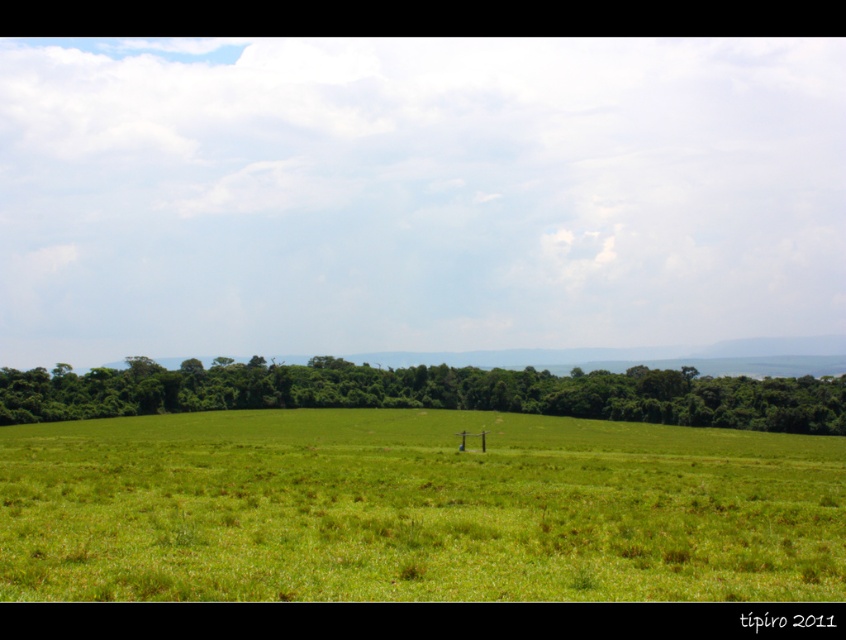
Question: Among these objects, which one is farthest from the camera?

Choices:
 (A) green leafy trees at center
 (B) green grassy pasture at center

Answer: (A)

Question: Can you confirm if green grassy pasture at center is wider than green leafy trees at center?

Choices:
 (A) yes
 (B) no

Answer: (B)

Question: In this image, where is green grassy pasture at center located relative to green leafy trees at center?

Choices:
 (A) left
 (B) right

Answer: (A)

Question: Does green grassy pasture at center appear on the right side of green leafy trees at center?

Choices:
 (A) no
 (B) yes

Answer: (A)